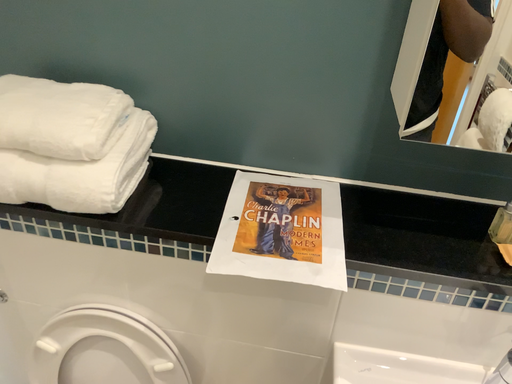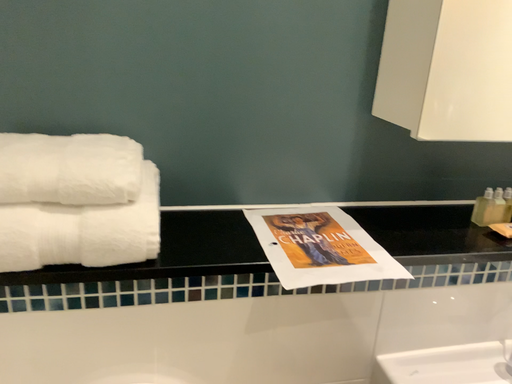
Question: How did the camera likely rotate when shooting the video?

Choices:
 (A) rotated left
 (B) rotated right

Answer: (B)